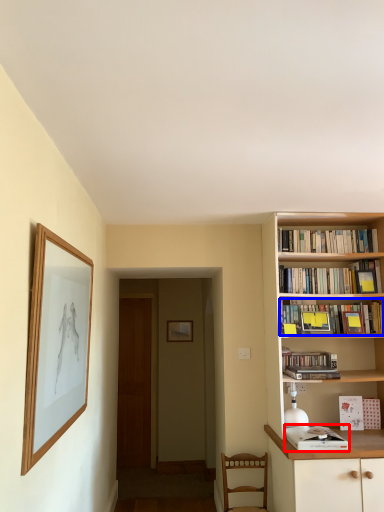
Question: Which object is further to the camera taking this photo, book (highlighted by a red box) or book (highlighted by a blue box)?

Choices:
 (A) book
 (B) book

Answer: (B)